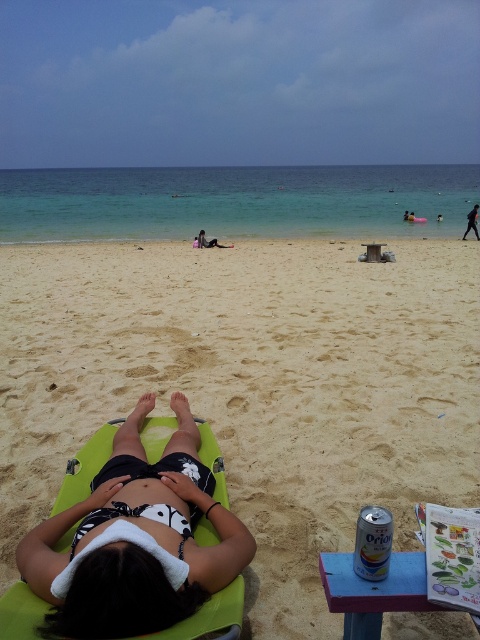
Question: Is fine-grained sand at center smaller than dark blue fabric at center?

Choices:
 (A) no
 (B) yes

Answer: (A)

Question: Considering the real-world distances, which object is closest to the dark blue fabric shorts at center?

Choices:
 (A) fine-grained sand at center
 (B) metallic blue picnic table at lower right

Answer: (A)

Question: Which of these objects is positioned farthest from the metallic blue picnic table at lower right?

Choices:
 (A) silver metallic can at lower right
 (B) wooden picnic table at center

Answer: (B)

Question: Considering the relative positions of green fabric beach chair at lower left and metallic blue picnic table at lower right in the image provided, where is green fabric beach chair at lower left located with respect to metallic blue picnic table at lower right?

Choices:
 (A) below
 (B) above

Answer: (B)

Question: Is metallic blue picnic table at lower right above silver metallic can at lower right?

Choices:
 (A) yes
 (B) no

Answer: (B)

Question: Which point is farther to the camera?

Choices:
 (A) (424, 608)
 (B) (385, 561)
 (C) (396, 353)
 (D) (370, 250)

Answer: (D)